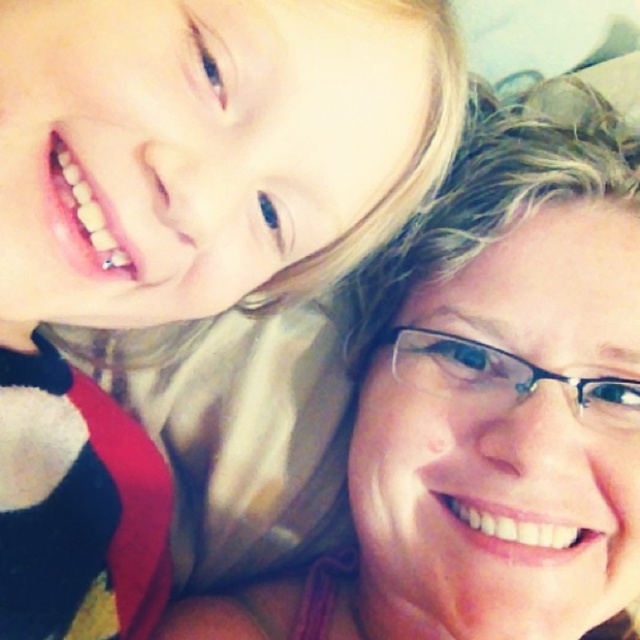
You are a photographer adjusting your camera settings. You notice the matte black shirt at upper left in the scene. Based on its position at coordinates point 0.370, 0.277, can you determine if it is closer to the top or the bottom of the image?

The matte black shirt at upper left is located at point 0.377, which is closer to the top of the image since the coordinate is closer to 0, indicating proximity to the top edge.

Consider the image. You are a photographer standing at the camera position. You want to take a photo of the scene but need to ensure that the subject at point (x=259, y=45) is in focus. What is the minimum distance you need to set your camera focus to capture this subject clearly?

The minimum distance you need to set your camera focus is 16.44 inches to capture the subject at point (x=259, y=45) clearly.

You are designing a new clothing line and want to ensure that the matte black shirt at upper left and the matte skin at upper right can be worn together without any issues. Based on their thickness, which one might require more fabric when creating a similar design?

The matte skin at upper right requires more fabric because it is thicker than the matte black shirt at upper left.